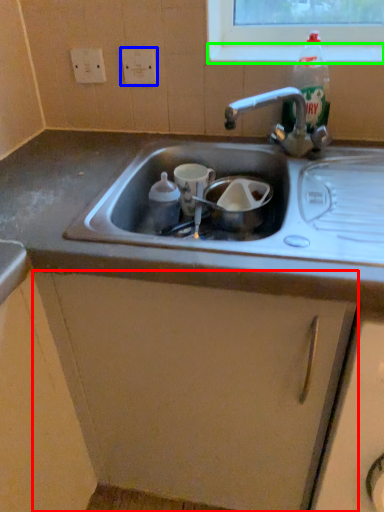
Question: Based on their relative distances, which object is nearer to cabinetry (highlighted by a red box)? Choose from electric outlet (highlighted by a blue box) and window sill (highlighted by a green box).

Choices:
 (A) electric outlet
 (B) window sill

Answer: (B)